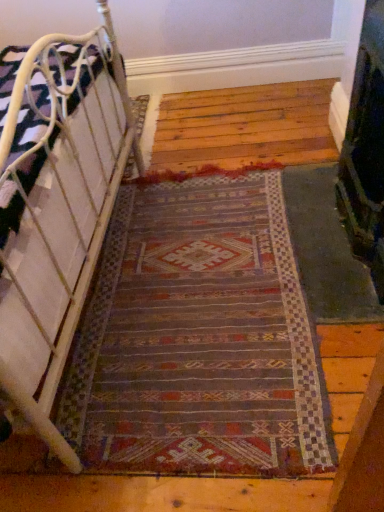
Describe the element at coordinates (365, 151) in the screenshot. I see `dark green textured fireplace at right` at that location.

Where is `white metal bed at left`? This screenshot has height=512, width=384. white metal bed at left is located at coordinates (58, 209).

Locate an element on the screen. multicolored woven rug at center is located at coordinates (198, 339).

Is white metal bed at left far from dark green textured fireplace at right?

No, white metal bed at left is not far away from dark green textured fireplace at right.

Is white metal bed at left taller or shorter than dark green textured fireplace at right?

Considering their sizes, white metal bed at left has less height than dark green textured fireplace at right.

Based on the photo, is white metal bed at left thinner than dark green textured fireplace at right?

No.

How far apart are white metal bed at left and dark green textured fireplace at right?

white metal bed at left and dark green textured fireplace at right are 37.93 inches apart from each other.

In terms of height, does white metal bed at left look taller or shorter compared to multicolored woven rug at center?

Considering their sizes, white metal bed at left has more height than multicolored woven rug at center.

I want to click on mat that appears on the right of white metal bed at left, so click(x=198, y=339).

Between white metal bed at left and multicolored woven rug at center, which one is positioned in front?

white metal bed at left is more forward.

Between white metal bed at left and multicolored woven rug at center, which one has larger size?

With larger size is white metal bed at left.

Where is `furniture above the multicolored woven rug at center (from the image's perspective)`? furniture above the multicolored woven rug at center (from the image's perspective) is located at coordinates [x=58, y=209].

Are multicolored woven rug at center and white metal bed at left beside each other?

No, multicolored woven rug at center is not next to white metal bed at left.

Which is closer to the camera, (135, 402) or (36, 247)?

Clearly, point (135, 402) is more distant from the camera than point (36, 247).

Can you tell me how much multicolored woven rug at center and white metal bed at left differ in facing direction?

They differ by 178 degrees in their facing directions.

At what (x,y) coordinates should I click in order to perform the action: click on fireplace located in front of the multicolored woven rug at center. Please return your answer as a coordinate pair (x, y). Looking at the image, I should click on (365, 151).

From the picture: From the image's perspective, which object appears higher, dark green textured fireplace at right or multicolored woven rug at center?

dark green textured fireplace at right, from the image's perspective.

Considering the positions of objects dark green textured fireplace at right and multicolored woven rug at center in the image provided, who is more to the left, dark green textured fireplace at right or multicolored woven rug at center?

Positioned to the left is multicolored woven rug at center.

Is dark green textured fireplace at right located within multicolored woven rug at center?

No, dark green textured fireplace at right is located outside of multicolored woven rug at center.

Which object is more forward, multicolored woven rug at center or dark green textured fireplace at right?

dark green textured fireplace at right is in front.

Is multicolored woven rug at center next to dark green textured fireplace at right and touching it?

multicolored woven rug at center and dark green textured fireplace at right are not in contact.

From a real-world perspective, is multicolored woven rug at center over dark green textured fireplace at right?

Incorrect, from a real-world perspective, multicolored woven rug at center is lower than dark green textured fireplace at right.

Looking at their sizes, would you say dark green textured fireplace at right is wider or thinner than white metal bed at left?

In the image, dark green textured fireplace at right appears to be more narrow than white metal bed at left.

Could you tell me if dark green textured fireplace at right is facing white metal bed at left?

Yes, dark green textured fireplace at right is oriented towards white metal bed at left.

What's the angular difference between dark green textured fireplace at right and white metal bed at left's facing directions?

They differ by 177 degrees in their facing directions.

Looking at the image, does dark green textured fireplace at right seem bigger or smaller compared to white metal bed at left?

dark green textured fireplace at right is smaller than white metal bed at left.

Locate an element on the screen. The width and height of the screenshot is (384, 512). fireplace behind the white metal bed at left is located at coordinates (365, 151).

At what (x,y) coordinates should I click in order to perform the action: click on mat below the white metal bed at left (from a real-world perspective). Please return your answer as a coordinate pair (x, y). This screenshot has height=512, width=384. Looking at the image, I should click on (198, 339).

Looking at this image, when comparing their distances from white metal bed at left, does multicolored woven rug at center or dark green textured fireplace at right seem closer?

multicolored woven rug at center lies closer to white metal bed at left than the other object.

From the image, which object appears to be farther from dark green textured fireplace at right, white metal bed at left or multicolored woven rug at center?

white metal bed at left is positioned further to the anchor dark green textured fireplace at right.

When comparing their distances from multicolored woven rug at center, does dark green textured fireplace at right or white metal bed at left seem closer?

Based on the image, white metal bed at left appears to be nearer to multicolored woven rug at center.

Considering their positions, is white metal bed at left positioned further to multicolored woven rug at center than dark green textured fireplace at right?

dark green textured fireplace at right.

Consider the image. From the image, which object appears to be farther from white metal bed at left, dark green textured fireplace at right or multicolored woven rug at center?

dark green textured fireplace at right is further to white metal bed at left.

Looking at this image, estimate the real-world distances between objects in this image. Which object is further from dark green textured fireplace at right, multicolored woven rug at center or white metal bed at left?

Among the two, white metal bed at left is located further to dark green textured fireplace at right.

The height and width of the screenshot is (512, 384). What are the coordinates of `mat located between white metal bed at left and dark green textured fireplace at right in the left-right direction` in the screenshot? It's located at (198, 339).